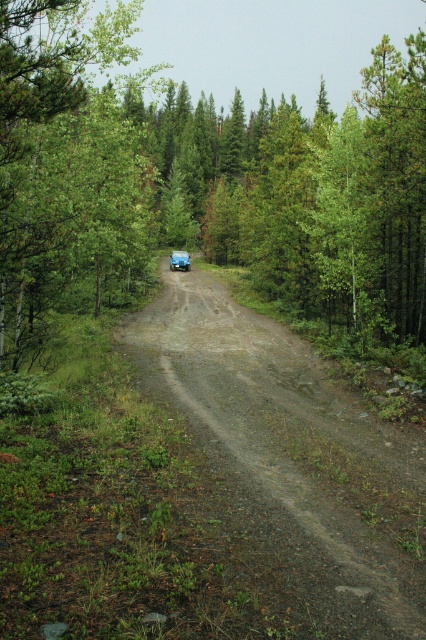
Can you confirm if green leafy tree at center is shorter than gray gravel road at center?

No.

Is point (175, 138) more distant than point (373, 616)?

Yes, point (175, 138) is behind point (373, 616).

I want to click on green leafy tree at center, so click(201, 182).

Does point (83, 52) lie in front of point (184, 252)?

Yes, it is.

Can you confirm if green leafy tree at left is wider than green matte jeep at center?

Indeed, green leafy tree at left has a greater width compared to green matte jeep at center.

Is point (132, 259) more distant than point (187, 260)?

No, (132, 259) is in front of (187, 260).

Identify the location of green leafy tree at left. (66, 170).

How far apart are green leafy tree at center and green matte jeep at center?

green leafy tree at center is 31.47 meters away from green matte jeep at center.

Which is more to the right, green leafy tree at center or green matte jeep at center?

From the viewer's perspective, green leafy tree at center appears more on the right side.

This screenshot has width=426, height=640. What are the coordinates of `green leafy tree at center` in the screenshot? It's located at (201, 182).